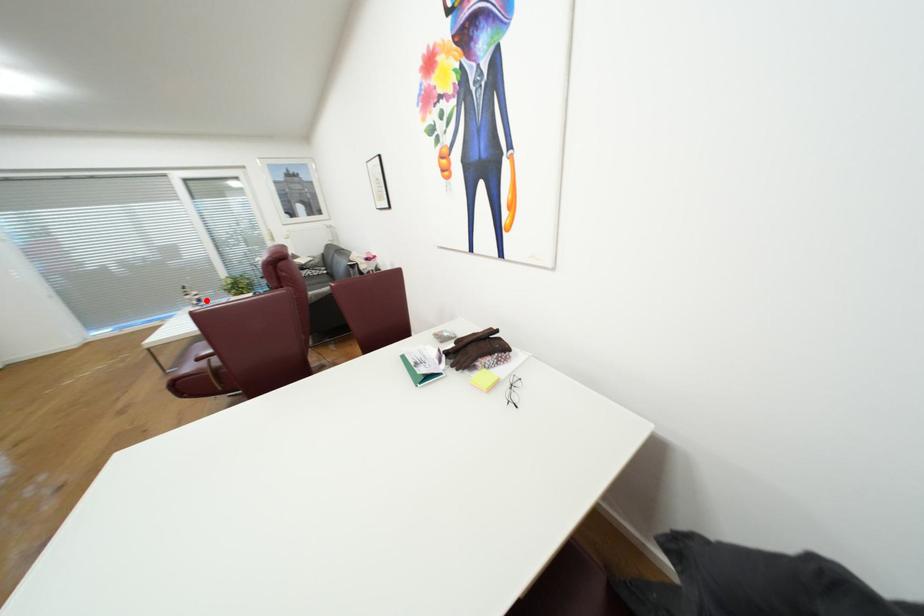
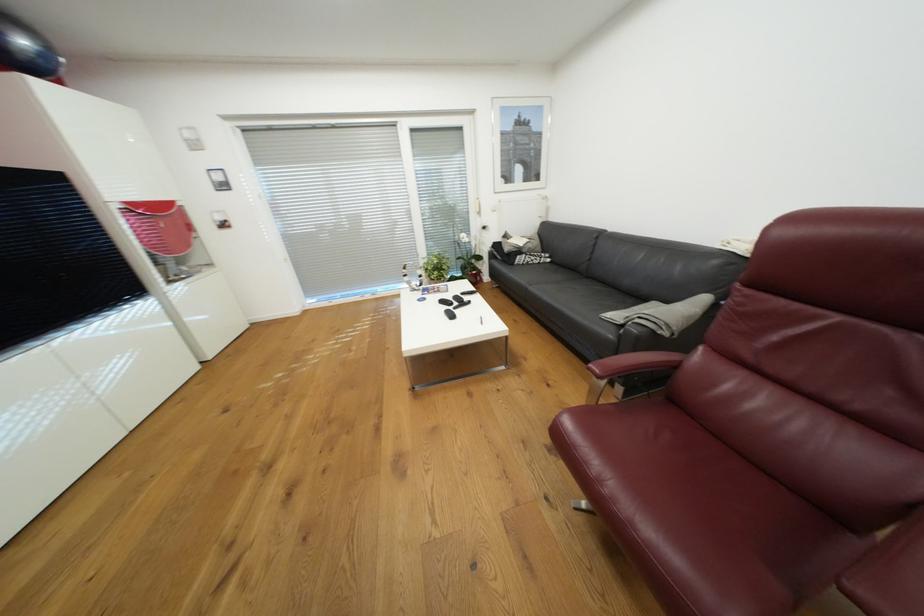
Question: I am providing you with two images of the same scene from different viewpoints. Image1 has a red point marked. In image2, the corresponding 3D location appears at what relative position? Reply with the corresponding letter.

Choices:
 (A) Closer
 (B) Farther

Answer: (B)